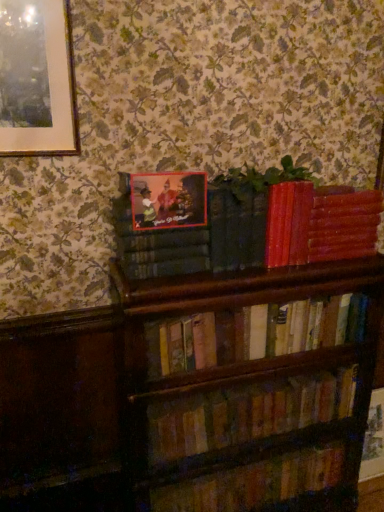
In order to face wooden bookshelf at lower center, the 3th book positioned from the top, should I rotate leftwards or rightwards?

A 8.434 degree turn to the right will do.

At what (x,y) coordinates should I click in order to perform the action: click on wooden book at lower center, which ranks as the first book in bottom-to-top order. Please return your answer as a coordinate pair (x, y). Looking at the image, I should click on (256, 482).

At what (x,y) coordinates should I click in order to perform the action: click on smooth red book at upper right, the 1th book from the top. Please return your answer as a coordinate pair (x, y). Looking at the image, I should click on (319, 224).

The image size is (384, 512). I want to click on wooden bookshelf at center, the second book viewed from the top, so click(253, 333).

Image resolution: width=384 pixels, height=512 pixels. What do you see at coordinates (168, 200) in the screenshot?
I see `matte plastic picture frame at upper center` at bounding box center [168, 200].

Locate an element on the screen. wooden bookshelf at lower center, arranged as the second book when ordered from the bottom is located at coordinates (247, 413).

From the image's perspective, count 2nd books downward from the wooden bookshelf at center, the second book viewed from the top, and point to it. Please provide its 2D coordinates.

[(256, 482)]

In the image, is wooden book at lower center, which is the fourth book from top to bottom, on the left side or the right side of wooden bookshelf at center, the second book viewed from the top?

In the image, wooden book at lower center, which is the fourth book from top to bottom, appears on the right side of wooden bookshelf at center, the second book viewed from the top.

Are wooden book at lower center, which is the fourth book from top to bottom, and wooden bookshelf at center, the 3th book positioned from the bottom, beside each other?

No, wooden book at lower center, which is the fourth book from top to bottom, is not touching wooden bookshelf at center, the 3th book positioned from the bottom.

Is wooden book at lower center, which is the fourth book from top to bottom, facing towards wooden bookshelf at center, the second book viewed from the top?

No, wooden book at lower center, which is the fourth book from top to bottom, is not turned towards wooden bookshelf at center, the second book viewed from the top.

Is wooden bookshelf at center, the 3th book positioned from the bottom, shorter than green matte plant at upper center?

No, wooden bookshelf at center, the 3th book positioned from the bottom, is not shorter than green matte plant at upper center.

Does wooden bookshelf at center, the 3th book positioned from the bottom, have a greater width compared to green matte plant at upper center?

No.

Is wooden bookshelf at center, the 3th book positioned from the bottom, far away from green matte plant at upper center?

No, wooden bookshelf at center, the 3th book positioned from the bottom, is not far away from green matte plant at upper center.

From the image's perspective, is wooden bookshelf at center, the 3th book positioned from the bottom, above green matte plant at upper center?

No.

From a real-world perspective, is smooth red book at upper right, acting as the 4th book starting from the bottom, above or below wooden bookshelf at lower center, the 3th book positioned from the top?

Clearly, from a real-world perspective, smooth red book at upper right, acting as the 4th book starting from the bottom, is above wooden bookshelf at lower center, the 3th book positioned from the top.

Which is in front, point (294, 261) or point (344, 398)?

The point (294, 261) is closer.

There is a smooth red book at upper right, the 1th book from the top. Identify the location of the 2nd book below it (from the image's perspective). The width and height of the screenshot is (384, 512). (247, 413).

Considering the sizes of objects smooth red book at upper right, acting as the 4th book starting from the bottom, and wooden bookshelf at lower center, the 3th book positioned from the top, in the image provided, who is smaller, smooth red book at upper right, acting as the 4th book starting from the bottom, or wooden bookshelf at lower center, the 3th book positioned from the top,?

With smaller size is smooth red book at upper right, acting as the 4th book starting from the bottom.

From the picture: What's the angular difference between wooden book at lower center, which ranks as the first book in bottom-to-top order, and green matte plant at upper center's facing directions?

The angle between the facing direction of wooden book at lower center, which ranks as the first book in bottom-to-top order, and the facing direction of green matte plant at upper center is 0.768 degrees.

From the image's perspective, relative to green matte plant at upper center, is wooden book at lower center, which ranks as the first book in bottom-to-top order, above or below?

wooden book at lower center, which ranks as the first book in bottom-to-top order, is situated lower than green matte plant at upper center in the image.

Could you measure the distance between wooden book at lower center, which ranks as the first book in bottom-to-top order, and green matte plant at upper center?

wooden book at lower center, which ranks as the first book in bottom-to-top order, is 3.41 feet away from green matte plant at upper center.

Between wooden book at lower center, which ranks as the first book in bottom-to-top order, and green matte plant at upper center, which one is positioned behind?

wooden book at lower center, which ranks as the first book in bottom-to-top order, is further from the camera.

From a real-world perspective, is green matte plant at upper center physically located above or below wooden bookshelf at lower center, the 3th book positioned from the top?

Clearly, from a real-world perspective, green matte plant at upper center is above wooden bookshelf at lower center, the 3th book positioned from the top.

Between green matte plant at upper center and wooden bookshelf at lower center, arranged as the second book when ordered from the bottom, which one has larger size?

wooden bookshelf at lower center, arranged as the second book when ordered from the bottom, is bigger.

Is green matte plant at upper center to the left or to the right of wooden bookshelf at lower center, arranged as the second book when ordered from the bottom, in the image?

green matte plant at upper center is to the right of wooden bookshelf at lower center, arranged as the second book when ordered from the bottom.

Is matte plastic picture frame at upper center to the left of wooden bookshelf at center, the 3th book positioned from the bottom, from the viewer's perspective?

Correct, you'll find matte plastic picture frame at upper center to the left of wooden bookshelf at center, the 3th book positioned from the bottom.

Which is in front, point (159, 189) or point (253, 322)?

The point (159, 189) is closer.

From the image's perspective, relative to wooden bookshelf at center, the 3th book positioned from the bottom, is matte plastic picture frame at upper center above or below?

matte plastic picture frame at upper center is above wooden bookshelf at center, the 3th book positioned from the bottom.

Identify the location of the 2nd book located beneath the matte plastic picture frame at upper center (from a real-world perspective). (253, 333).

Between matte plastic picture frame at upper center and wooden bookshelf at lower center, arranged as the second book when ordered from the bottom, which one has less height?

matte plastic picture frame at upper center is shorter.

From a real-world perspective, does matte plastic picture frame at upper center stand above wooden bookshelf at lower center, the 3th book positioned from the top?

Yes, from a real-world perspective, matte plastic picture frame at upper center is over wooden bookshelf at lower center, the 3th book positioned from the top

Is matte plastic picture frame at upper center positioned beyond the bounds of wooden bookshelf at lower center, arranged as the second book when ordered from the bottom?

Yes, matte plastic picture frame at upper center is not within wooden bookshelf at lower center, arranged as the second book when ordered from the bottom.

From the wooden book at lower center, which ranks as the first book in bottom-to-top order, count 3rd books forward and point to it. Please provide its 2D coordinates.

[(253, 333)]

From the green matte plant at upper center, count the 3rd book to the left and point to it. Please provide its 2D coordinates.

[(253, 333)]

From the image, which object appears to be farther from smooth red book at upper right, acting as the 4th book starting from the bottom, wooden bookshelf at center, the 3th book positioned from the bottom, or green matte plant at upper center?

wooden bookshelf at center, the 3th book positioned from the bottom, is positioned further to the anchor smooth red book at upper right, acting as the 4th book starting from the bottom.

Considering their positions, is wooden bookshelf at lower center, the 3th book positioned from the top, positioned closer to matte plastic picture frame at upper center than green matte plant at upper center?

green matte plant at upper center is closer to matte plastic picture frame at upper center.

Estimate the real-world distances between objects in this image. Which object is further from wooden bookshelf at lower center, the 3th book positioned from the top, green matte plant at upper center or matte plastic picture frame at upper center?

The object further to wooden bookshelf at lower center, the 3th book positioned from the top, is green matte plant at upper center.

From the image, which object appears to be farther from smooth red book at upper right, acting as the 4th book starting from the bottom, wooden book at lower center, which is the fourth book from top to bottom, or green matte plant at upper center?

The object further to smooth red book at upper right, acting as the 4th book starting from the bottom, is wooden book at lower center, which is the fourth book from top to bottom.

Estimate the real-world distances between objects in this image. Which object is closer to smooth red book at upper right, the 1th book from the top, matte plastic picture frame at upper center or wooden book at lower center, which ranks as the first book in bottom-to-top order?

matte plastic picture frame at upper center.

Considering their positions, is smooth red book at upper right, acting as the 4th book starting from the bottom, positioned closer to wooden bookshelf at lower center, the 3th book positioned from the top, than wooden bookshelf at center, the second book viewed from the top?

wooden bookshelf at center, the second book viewed from the top, is closer to wooden bookshelf at lower center, the 3th book positioned from the top.

Estimate the real-world distances between objects in this image. Which object is closer to smooth red book at upper right, acting as the 4th book starting from the bottom, wooden bookshelf at center, the second book viewed from the top, or wooden bookshelf at lower center, arranged as the second book when ordered from the bottom?

The object closer to smooth red book at upper right, acting as the 4th book starting from the bottom, is wooden bookshelf at center, the second book viewed from the top.

Looking at the image, which one is located further to wooden bookshelf at center, the 3th book positioned from the bottom, green matte plant at upper center or smooth red book at upper right, acting as the 4th book starting from the bottom?

green matte plant at upper center is positioned further to the anchor wooden bookshelf at center, the 3th book positioned from the bottom.

I want to click on picture frame between green matte plant at upper center and wooden book at lower center, which is the fourth book from top to bottom, in the up-down direction, so click(x=168, y=200).

Identify the location of picture frame between green matte plant at upper center and wooden bookshelf at center, the 3th book positioned from the bottom, in the up-down direction. The height and width of the screenshot is (512, 384). (168, 200).

Where is `book between wooden bookshelf at center, the second book viewed from the top, and wooden book at lower center, which is the fourth book from top to bottom, in the up-down direction`? Image resolution: width=384 pixels, height=512 pixels. book between wooden bookshelf at center, the second book viewed from the top, and wooden book at lower center, which is the fourth book from top to bottom, in the up-down direction is located at coordinates 247,413.

The height and width of the screenshot is (512, 384). I want to click on picture frame between green matte plant at upper center and wooden bookshelf at lower center, the 3th book positioned from the top, in the vertical direction, so click(x=168, y=200).